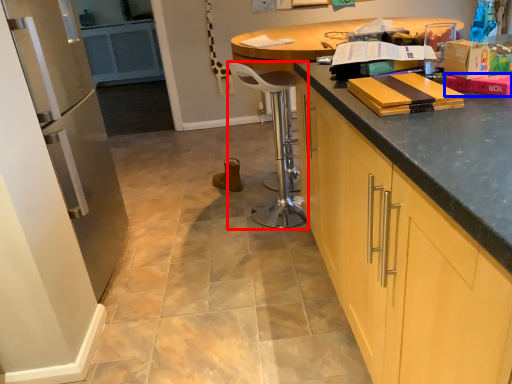
Question: Which of the following is the closest to the observer, bar stool (highlighted by a red box) or book (highlighted by a blue box)?

Choices:
 (A) bar stool
 (B) book

Answer: (B)